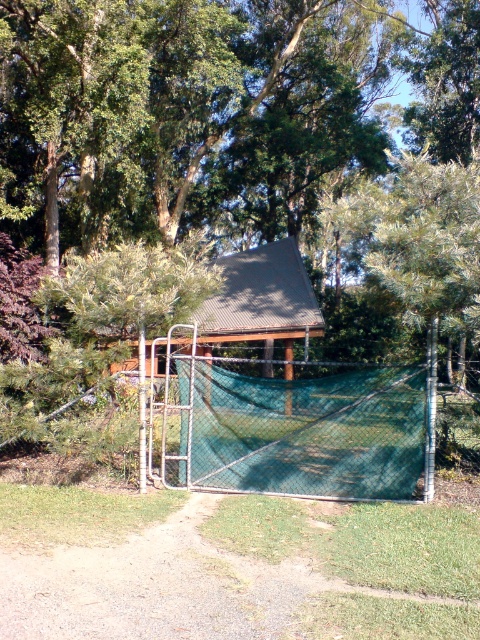
Question: Does green mesh tennis net at center appear under green corrugated metal hut at center?

Choices:
 (A) no
 (B) yes

Answer: (B)

Question: Based on their relative distances, which object is farther from the green mesh tennis net at center?

Choices:
 (A) green corrugated metal hut at center
 (B) green leafy tree at center

Answer: (B)

Question: Is green leafy tree at center thinner than green mesh tennis net at center?

Choices:
 (A) no
 (B) yes

Answer: (A)

Question: Is green leafy tree at center positioned before green corrugated metal hut at center?

Choices:
 (A) yes
 (B) no

Answer: (A)

Question: Which of the following is the closest to the observer?

Choices:
 (A) green leafy tree at center
 (B) green mesh tennis net at center

Answer: (A)

Question: Which object appears farthest from the camera in this image?

Choices:
 (A) green leafy tree at center
 (B) green corrugated metal hut at center
 (C) green mesh tennis net at center

Answer: (B)